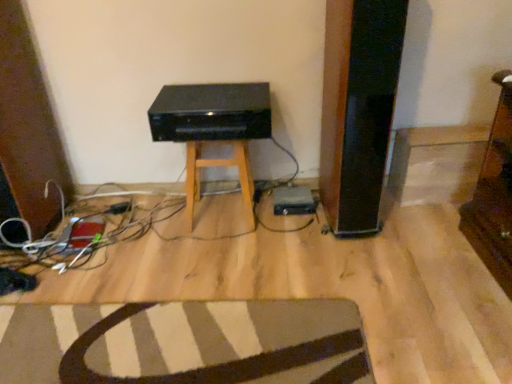
Question: Is black plastic stereo at center at the right side of black matte stool at center?

Choices:
 (A) no
 (B) yes

Answer: (A)

Question: Does black plastic stereo at center have a greater height compared to black matte stool at center?

Choices:
 (A) yes
 (B) no

Answer: (B)

Question: Does black plastic stereo at center lie in front of black matte stool at center?

Choices:
 (A) yes
 (B) no

Answer: (A)

Question: Can black matte stool at center be found inside black plastic stereo at center?

Choices:
 (A) yes
 (B) no

Answer: (B)

Question: Are black plastic stereo at center and black matte stool at center far apart?

Choices:
 (A) yes
 (B) no

Answer: (B)

Question: Considering the relative positions of black plastic plug at lower left and striped fabric rug at lower center in the image provided, is black plastic plug at lower left to the left or to the right of striped fabric rug at lower center?

Choices:
 (A) left
 (B) right

Answer: (A)

Question: Which is correct: black plastic plug at lower left is inside striped fabric rug at lower center, or outside of it?

Choices:
 (A) outside
 (B) inside

Answer: (A)

Question: From a real-world perspective, is black plastic plug at lower left above or below striped fabric rug at lower center?

Choices:
 (A) below
 (B) above

Answer: (B)

Question: From the image's perspective, is black plastic plug at lower left above or below striped fabric rug at lower center?

Choices:
 (A) below
 (B) above

Answer: (B)

Question: Would you say black matte stool at center is inside or outside striped fabric rug at lower center?

Choices:
 (A) outside
 (B) inside

Answer: (A)

Question: Considering the relative positions of black matte stool at center and striped fabric rug at lower center in the image provided, is black matte stool at center to the left or to the right of striped fabric rug at lower center?

Choices:
 (A) left
 (B) right

Answer: (B)

Question: From the image's perspective, is black matte stool at center positioned above or below striped fabric rug at lower center?

Choices:
 (A) above
 (B) below

Answer: (A)

Question: Considering the positions of point (240, 172) and point (366, 367), is point (240, 172) closer or farther from the camera than point (366, 367)?

Choices:
 (A) farther
 (B) closer

Answer: (A)

Question: From a real-world perspective, is striped fabric rug at lower center physically located above or below black plastic stereo at center?

Choices:
 (A) below
 (B) above

Answer: (A)

Question: Is point (348, 370) positioned closer to the camera than point (183, 137)?

Choices:
 (A) closer
 (B) farther

Answer: (A)